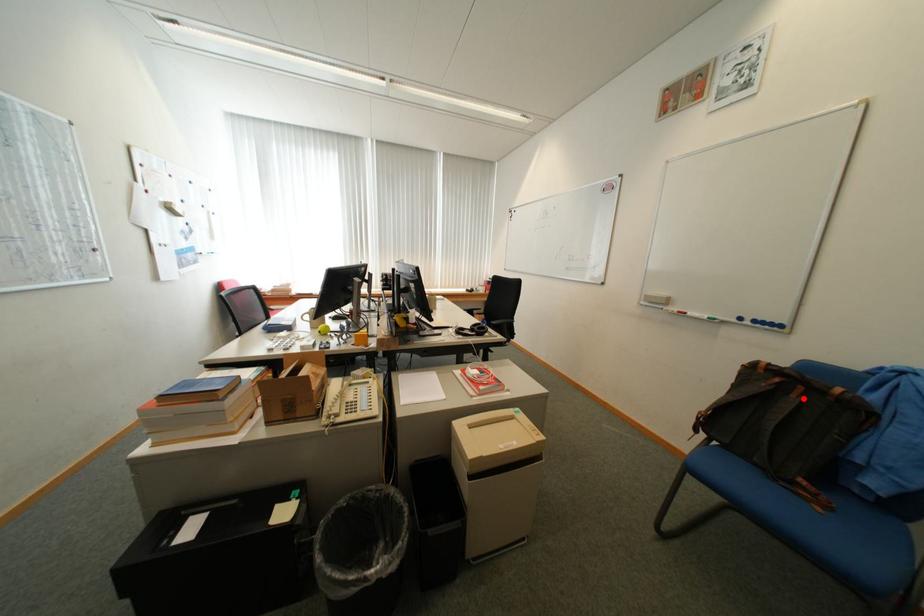
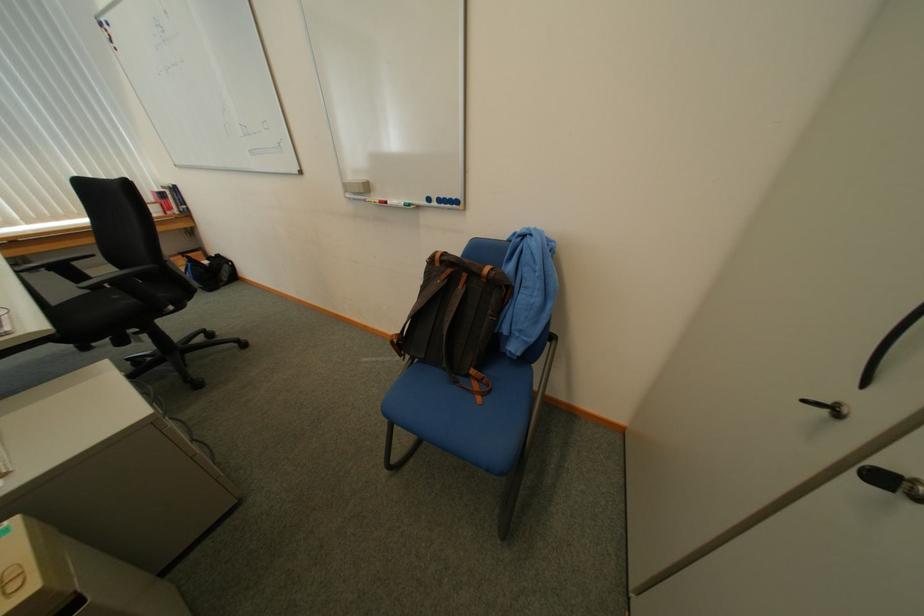
Locate, in the second image, the point that corresponds to the highlighted location in the first image.

(469, 290)